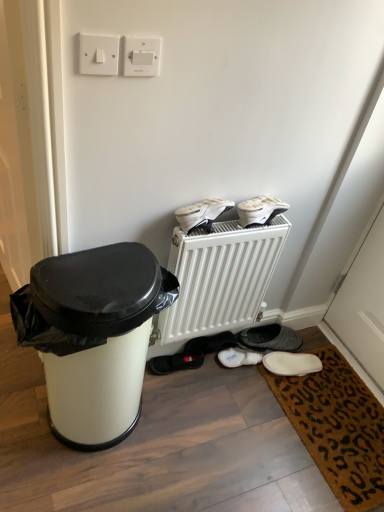
The image size is (384, 512). Find the location of `vacant area that is in front of white matte plastic trash can at left`. vacant area that is in front of white matte plastic trash can at left is located at coordinates (87, 481).